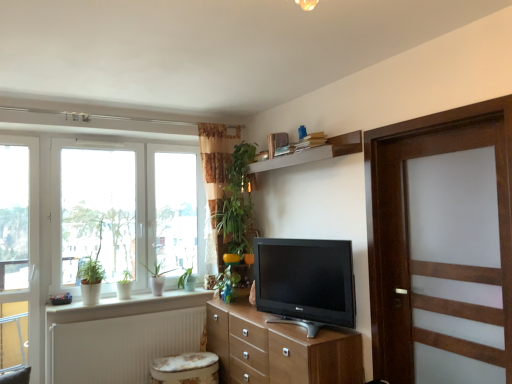
Find the location of a particular element. This screenshot has height=384, width=512. free spot above floral fabric music stool at lower center (from a real-world perspective) is located at coordinates (186, 360).